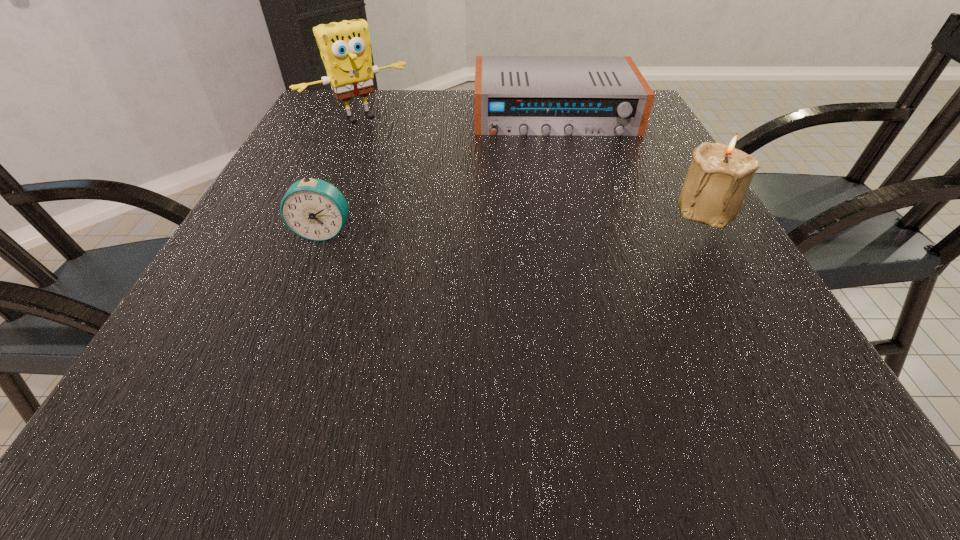
This screenshot has height=540, width=960. I want to click on free space located 0.190m on the front panel of the shortest object, so click(x=570, y=183).

Identify the location of free location located on the front panel of the shortest object. (574, 200).

Identify the location of sponge at the far edge. This screenshot has height=540, width=960. (345, 49).

You are a GUI agent. You are given a task and a screenshot of the screen. Output one action in this format:
    pyautogui.click(x=<x>, y=<y>)
    Task: Click on the radio receiver that is at the far edge
    
    Given the screenshot: What is the action you would take?
    (x=514, y=95)

I want to click on alarm clock located in the left edge section of the desktop, so click(x=314, y=209).

At what (x,y) coordinates should I click in order to perform the action: click on sponge present at the left edge. Please return your answer as a coordinate pair (x, y). This screenshot has height=540, width=960. Looking at the image, I should click on (345, 49).

You are a GUI agent. You are given a task and a screenshot of the screen. Output one action in this format:
    pyautogui.click(x=<x>, y=<y>)
    Task: Click on the candle_holder located at the right edge
    The height and width of the screenshot is (540, 960).
    Given the screenshot: What is the action you would take?
    coord(713,193)

In order to click on radio receiver that is at the right edge in this screenshot , I will do `click(514, 95)`.

In order to click on object that is positioned at the far left corner in this screenshot , I will do `click(345, 49)`.

Image resolution: width=960 pixels, height=540 pixels. I want to click on object that is at the far right corner, so click(514, 95).